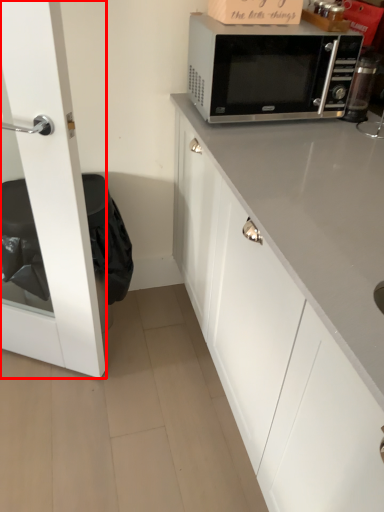
Question: From the image's perspective, where is glass door (annotated by the red box) located relative to microwave oven?

Choices:
 (A) above
 (B) below

Answer: (B)